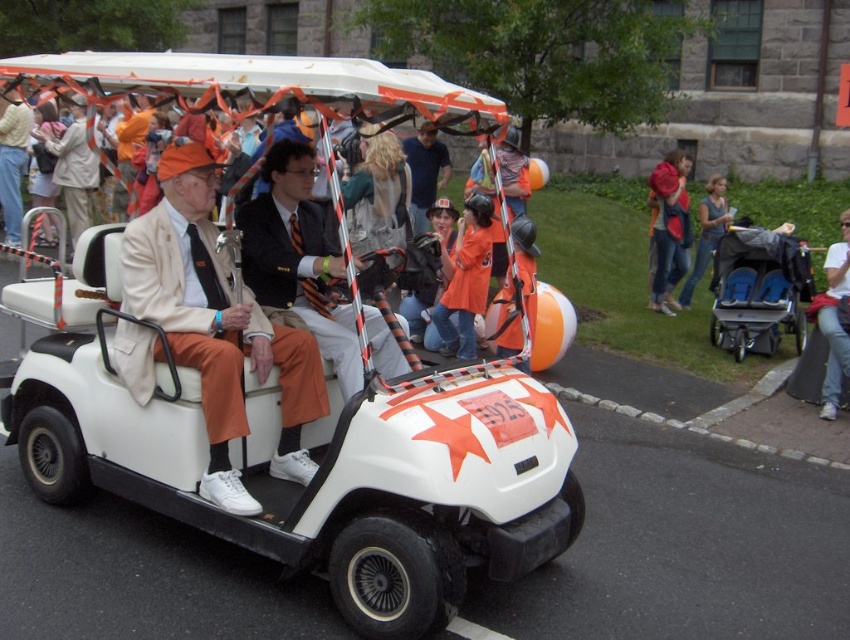
Between point (286, 448) and point (290, 289), which one is positioned behind?

Point (290, 289)

Who is positioned more to the right, matte beige suit at left or orange suit at center?

orange suit at center

Where is `matte beige suit at left`? This screenshot has height=640, width=850. matte beige suit at left is located at coordinates (217, 326).

I want to click on matte beige suit at left, so click(x=217, y=326).

Between denim jeans at lower right and orange fabric hat at center, which one appears on the right side from the viewer's perspective?

From the viewer's perspective, denim jeans at lower right appears more on the right side.

Is denim jeans at lower right bigger than orange fabric hat at center?

Actually, denim jeans at lower right might be smaller than orange fabric hat at center.

I want to click on denim jeans at lower right, so click(834, 320).

Looking at this image, who is positioned more to the left, white matte golf cart at center or denim jeans at lower right?

From the viewer's perspective, white matte golf cart at center appears more on the left side.

Between point (431, 385) and point (837, 280), which one is positioned in front?

Point (431, 385) is in front.

This screenshot has height=640, width=850. Find the location of `white matte golf cart at center`. white matte golf cart at center is located at coordinates (280, 420).